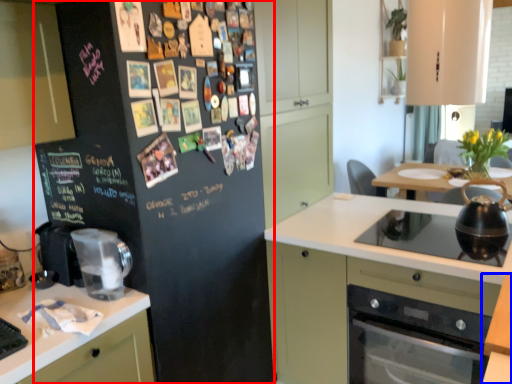
Question: Which object appears farthest to the camera in this image, refrigerator (highlighted by a red box) or table (highlighted by a blue box)?

Choices:
 (A) refrigerator
 (B) table

Answer: (A)